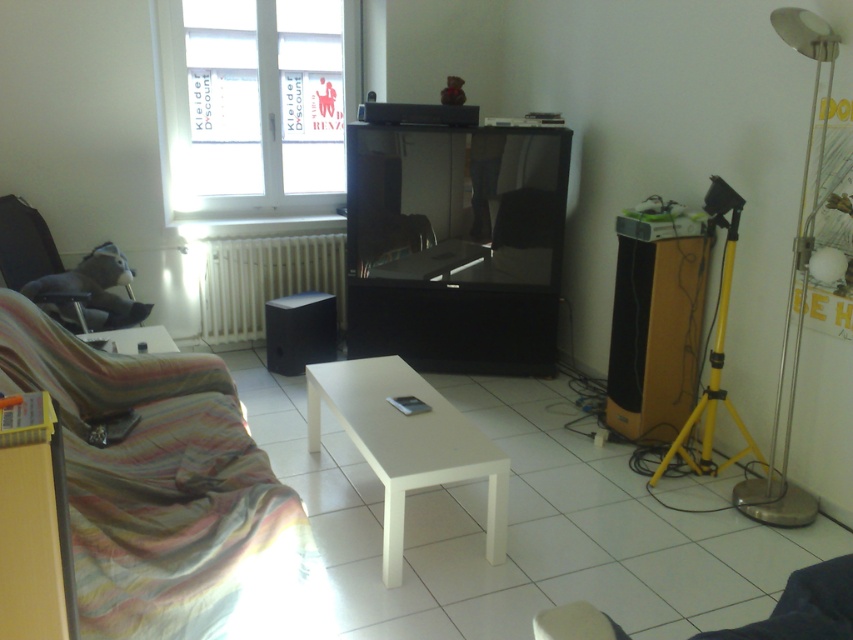
You are a delivery person who needs to place a large package on the widest surface in the room. Which object should you choose between the transparent glass window at upper left and the white glossy table at center?

The transparent glass window at upper left is wider than the white glossy table at center, so you should choose the transparent glass window at upper left to place the large package.

You are standing in the living room and want to sit on the striped fabric couch at lower left. Which direction should you walk from your current position at point (167, 496)?

The point (167, 496) is already the location of the striped fabric couch at lower left, so you are already sitting there.